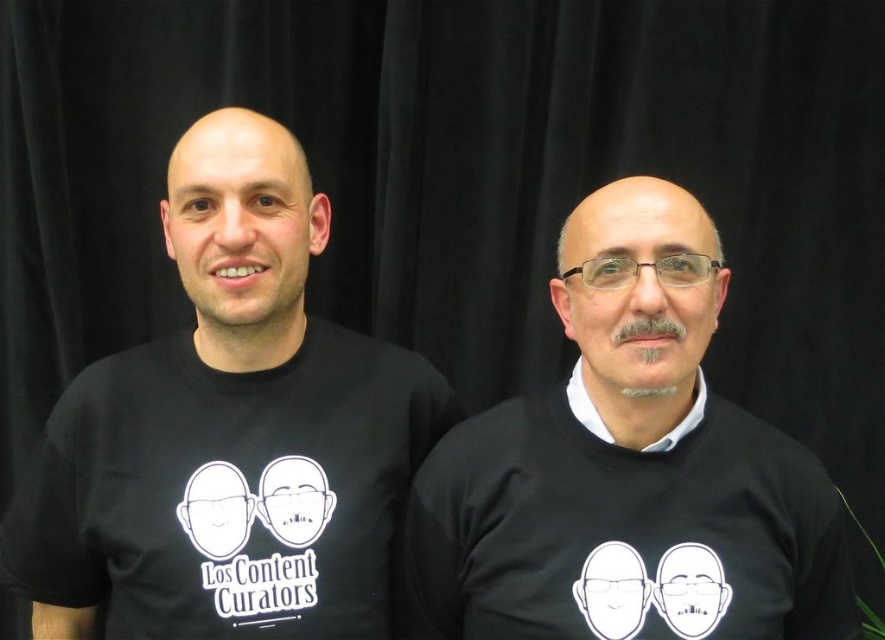
Does black matte t-shirt at left have a lesser width compared to black matte t-shirt at center?

No, black matte t-shirt at left is not thinner than black matte t-shirt at center.

Is point (356, 636) farther from camera compared to point (533, 436)?

Yes.

Does point (68, 509) come in front of point (589, 582)?

No, it is behind (589, 582).

Locate an element on the screen. black matte t-shirt at left is located at coordinates (228, 433).

Is black matte t-shirt at center bigger than black matte shirt at center?

Indeed, black matte t-shirt at center has a larger size compared to black matte shirt at center.

Is black matte t-shirt at center wider than black matte shirt at center?

Yes.

Image resolution: width=885 pixels, height=640 pixels. What do you see at coordinates (626, 470) in the screenshot?
I see `black matte t-shirt at center` at bounding box center [626, 470].

At what (x,y) coordinates should I click in order to perform the action: click on black matte t-shirt at center. Please return your answer as a coordinate pair (x, y). This screenshot has width=885, height=640. Looking at the image, I should click on (626, 470).

Can you confirm if black matte t-shirt at left is taller than black matte shirt at center?

Yes, black matte t-shirt at left is taller than black matte shirt at center.

Who is shorter, black matte t-shirt at left or black matte shirt at center?

With less height is black matte shirt at center.

Which is in front, point (374, 385) or point (696, 388)?

Point (696, 388)

Identify the location of black matte t-shirt at left. This screenshot has width=885, height=640. (228, 433).